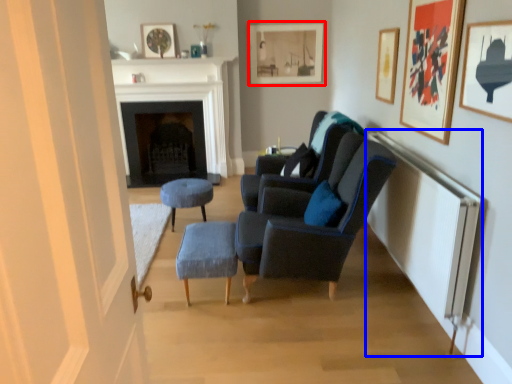
Question: Which point is closer to the camera, picture frame (highlighted by a red box) or radiator (highlighted by a blue box)?

Choices:
 (A) picture frame
 (B) radiator

Answer: (B)